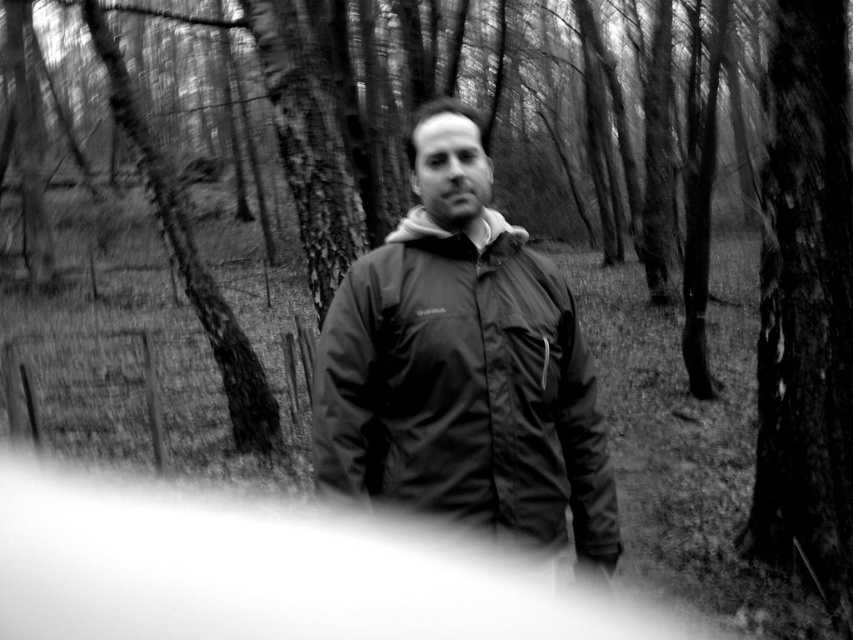
You are a photographer analyzing the composition of this black and white photo. You notice the matte black jacket at center and the smooth bark tree at right. Which object is positioned lower in the frame?

The matte black jacket at center is below the smooth bark tree at right, so the matte black jacket at center is positioned lower in the frame.

You are a photographer trying to capture the scene from the same angle as the image. You want to place a marker at both point coordinates provided. Which marker will be closer to the camera, the point at [321,458] or the point at [799,412]?

The point at [321,458] is in front of the point at [799,412], so the marker at point [321,458] will be closer to the camera.

You are a photographer analyzing the composition of this black and white photo. The matte black jacket at center is positioned at coordinates 0.609, 0.545. If you want to place the jacket exactly at the center of the image using the rule of thirds grid, which direction should you move it?

The matte black jacket at center is currently at coordinates (463, 388). To place it exactly at the center of the image, you would need to move it slightly to the left and up, as the true center of the image is at coordinates (426, 320).